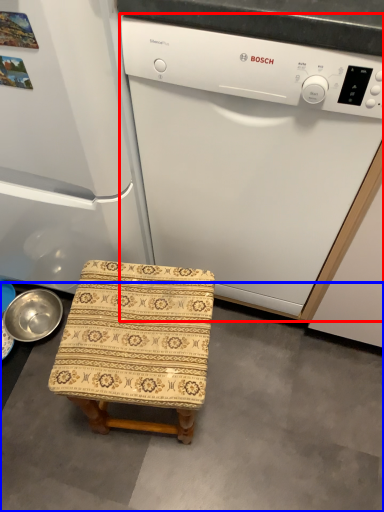
Question: Which object appears closest to the camera in this image, home appliance (highlighted by a red box) or concrete (highlighted by a blue box)?

Choices:
 (A) home appliance
 (B) concrete

Answer: (A)